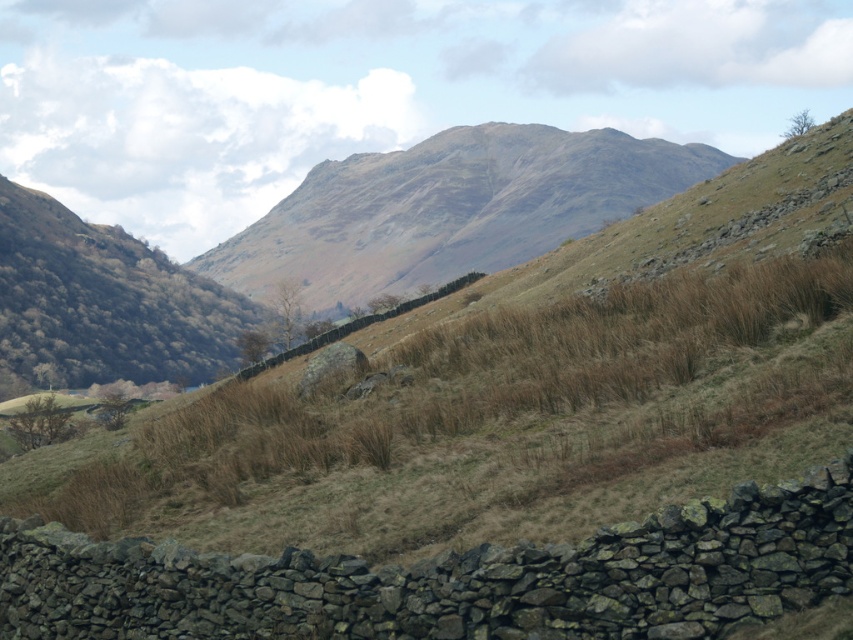
Does brown dry grass at center come in front of rugged stone mountain at center?

Yes.

Can you confirm if brown dry grass at center is positioned to the left of rugged stone mountain at center?

Correct, you'll find brown dry grass at center to the left of rugged stone mountain at center.

Which is behind, point (241, 419) or point (438, 252)?

Point (438, 252)

Identify the location of brown dry grass at center. The height and width of the screenshot is (640, 853). (486, 420).